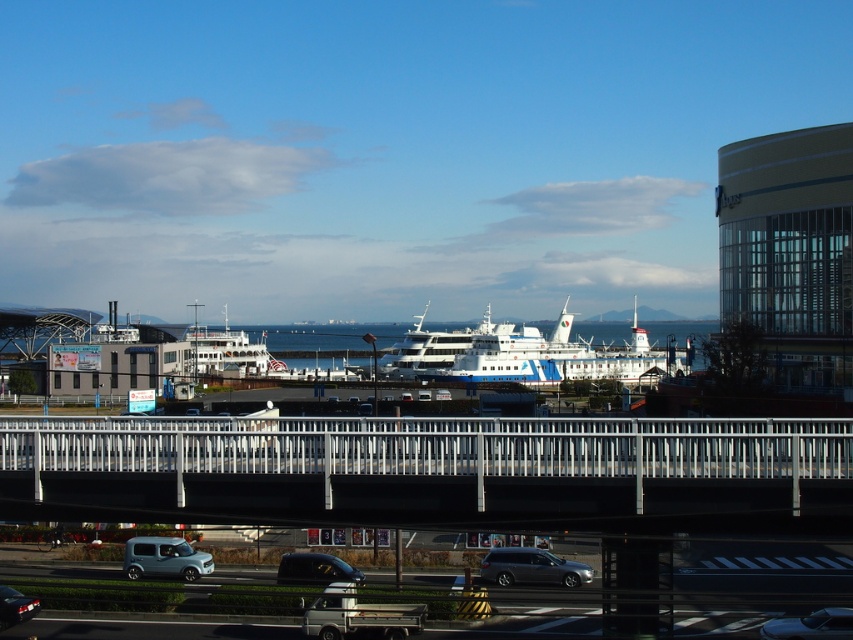
Question: From the image, what is the correct spatial relationship of white glossy ferry at center in relation to matte black car at lower left?

Choices:
 (A) above
 (B) below

Answer: (A)

Question: Which of the following is the closest to the observer?

Choices:
 (A) matte black car at lower left
 (B) metallic silver car at lower right

Answer: (B)

Question: Based on their relative distances, which object is farther from the white glossy ship at center?

Choices:
 (A) white glossy ferry at center
 (B) silver metallic bridge at center

Answer: (B)

Question: Is metallic blue suv at lower left positioned before matte black van at center?

Choices:
 (A) yes
 (B) no

Answer: (B)

Question: Is white glossy ship at center to the left of metallic gray station wagon at center from the viewer's perspective?

Choices:
 (A) no
 (B) yes

Answer: (A)

Question: Estimate the real-world distances between objects in this image. Which object is farther from the white glossy ferry at center?

Choices:
 (A) metallic blue suv at lower left
 (B) matte black van at center
 (C) matte black car at lower left
 (D) metallic gray station wagon at center

Answer: (C)